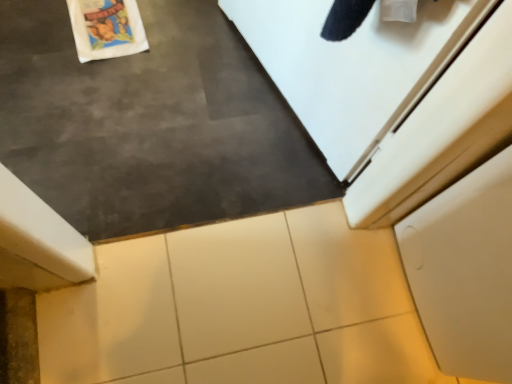
Locate an element on the screen. This screenshot has width=512, height=384. slate at center is located at coordinates (150, 124).

Locate an element on the screen. white matte cabinet at lower right is located at coordinates (465, 271).

Locate an element on the screen. white glossy tile at center is located at coordinates (241, 308).

Is point (329, 274) behind point (304, 314)?

That is True.

Is white glossy tile at center spatially inside white tile at center, or outside of it?

white glossy tile at center is spatially situated outside white tile at center.

Between white glossy tile at center and white tile at center, which one appears on the left side from the viewer's perspective?

white glossy tile at center.

Identify the location of tile on the left side of white tile at center. This screenshot has width=512, height=384. (241, 308).

Who is shorter, white tile at center or slate at center?

white tile at center.

From a real-world perspective, is white tile at center positioned under slate at center based on gravity?

Yes, from a real-world perspective, white tile at center is below slate at center.

Relative to slate at center, is white tile at center in front or behind?

white tile at center is behind slate at center.

Is white tile at center facing away from white matte cabinet at lower right?

white tile at center does not have its back to white matte cabinet at lower right.

Is white tile at center spatially inside white matte cabinet at lower right, or outside of it?

white tile at center is not inside white matte cabinet at lower right, it's outside.

Based on the photo, does white tile at center have a lesser height compared to white matte cabinet at lower right?

Yes.

Considering the sizes of objects white tile at center and white matte cabinet at lower right in the image provided, who is smaller, white tile at center or white matte cabinet at lower right?

Smaller between the two is white tile at center.

How different are the orientations of white matte cabinet at lower right and white tile at center in degrees?

150 degrees.

From the image's perspective, which one is positioned lower, white matte cabinet at lower right or white tile at center?

white tile at center is shown below in the image.

Do you think white matte cabinet at lower right is within white tile at center, or outside of it?

The correct answer is: outside.

Which is closer to the camera, (x=458, y=208) or (x=281, y=288)?

Positioned in front is point (x=458, y=208).

Is slate at center facing away from white glossy tile at center?

No, slate at center is not facing away from white glossy tile at center.

Do you think slate at center is within white glossy tile at center, or outside of it?

slate at center is outside white glossy tile at center.

Does slate at center touch white glossy tile at center?

No, slate at center is not next to white glossy tile at center.

Locate an element on the screen. tile that is on the left side of slate at center is located at coordinates (241, 308).

From the image's perspective, is white matte cabinet at lower right under slate at center?

Indeed, from the image's perspective, white matte cabinet at lower right is shown beneath slate at center.

Looking at this image, can you confirm if white matte cabinet at lower right is wider than slate at center?

Yes.

Is white matte cabinet at lower right facing towards slate at center?

No, white matte cabinet at lower right is not turned towards slate at center.

Is slate at center located within white matte cabinet at lower right?

Definitely not — slate at center is not inside white matte cabinet at lower right.

Measure the distance from white glossy tile at center to slate at center.

white glossy tile at center is 12.21 inches from slate at center.

Can you see white glossy tile at center touching slate at center?

Answer: No.

From a real-world perspective, which is physically above, white glossy tile at center or slate at center?

slate at center.

Is white glossy tile at center to the left or to the right of slate at center in the image?

white glossy tile at center is positioned on slate at center's left side.

This screenshot has width=512, height=384. I want to click on granite behind the white glossy tile at center, so click(236, 286).

Locate an element on the screen. slate above the white tile at center (from the image's perspective) is located at coordinates (150, 124).

When comparing their distances from white tile at center, does slate at center or white matte cabinet at lower right seem closer?

slate at center is closer to white tile at center.

When comparing their distances from white glossy tile at center, does white tile at center or slate at center seem further?

slate at center is further to white glossy tile at center.

Estimate the real-world distances between objects in this image. Which object is closer to white tile at center, white glossy tile at center or slate at center?

Based on the image, white glossy tile at center appears to be nearer to white tile at center.

Looking at the image, which one is located closer to slate at center, white tile at center or white matte cabinet at lower right?

white tile at center lies closer to slate at center than the other object.

From the image, which object appears to be farther from slate at center, white matte cabinet at lower right or white tile at center?

Among the two, white matte cabinet at lower right is located further to slate at center.

Considering their positions, is white glossy tile at center positioned closer to white tile at center than white matte cabinet at lower right?

Among the two, white glossy tile at center is located nearer to white tile at center.

Looking at the image, which one is located closer to slate at center, white matte cabinet at lower right or white glossy tile at center?

Among the two, white glossy tile at center is located nearer to slate at center.

Consider the image. Estimate the real-world distances between objects in this image. Which object is closer to white matte cabinet at lower right, white tile at center or slate at center?

Based on the image, white tile at center appears to be nearer to white matte cabinet at lower right.

The height and width of the screenshot is (384, 512). I want to click on granite located between white glossy tile at center and white matte cabinet at lower right in the left-right direction, so click(x=236, y=286).

Locate an element on the screen. The height and width of the screenshot is (384, 512). cabinetry between slate at center and white tile at center along the z-axis is located at coordinates (465, 271).

At what (x,y) coordinates should I click in order to perform the action: click on cabinetry between slate at center and white glossy tile at center in the front-back direction. Please return your answer as a coordinate pair (x, y). Looking at the image, I should click on (465, 271).

You are a GUI agent. You are given a task and a screenshot of the screen. Output one action in this format:
    pyautogui.click(x=<x>, y=<y>)
    Task: Click on the tile between slate at center and white tile at center along the z-axis
    Image resolution: width=512 pixels, height=384 pixels.
    Given the screenshot: What is the action you would take?
    pyautogui.click(x=241, y=308)